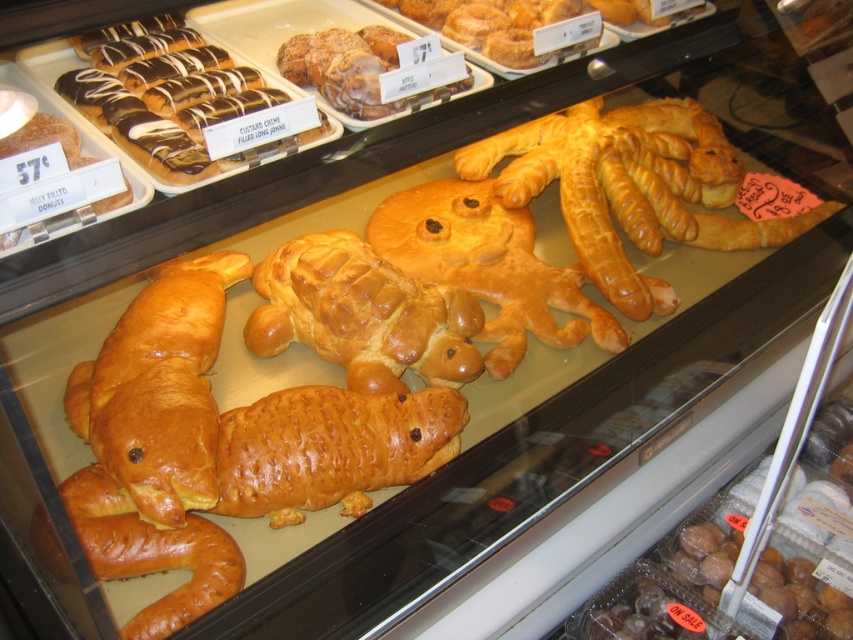
Which is more to the left, golden brown croissant at left or golden brown croissant at center?

golden brown croissant at left is more to the left.

Which of these two, golden brown croissant at left or golden brown croissant at center, stands taller?

golden brown croissant at left is taller.

Which is in front, point (202, 365) or point (86, 524)?

Point (86, 524) is in front.

The image size is (853, 640). I want to click on golden brown croissant at left, so click(x=160, y=388).

Is golden brown braided pastry at center wider than golden brown croissant at center?

Correct, the width of golden brown braided pastry at center exceeds that of golden brown croissant at center.

Is golden brown braided pastry at center taller than golden brown croissant at center?

Yes.

Who is more forward, (361, 385) or (144, 531)?

Positioned in front is point (144, 531).

Where is `golden brown braided pastry at center`? Image resolution: width=853 pixels, height=640 pixels. golden brown braided pastry at center is located at coordinates (363, 314).

Does golden brown croissant at left have a lesser width compared to golden brown braided pastry at center?

Yes, golden brown croissant at left is thinner than golden brown braided pastry at center.

Who is lower down, golden brown croissant at left or golden brown braided pastry at center?

Positioned lower is golden brown croissant at left.

The width and height of the screenshot is (853, 640). Identify the location of golden brown croissant at left. (160, 388).